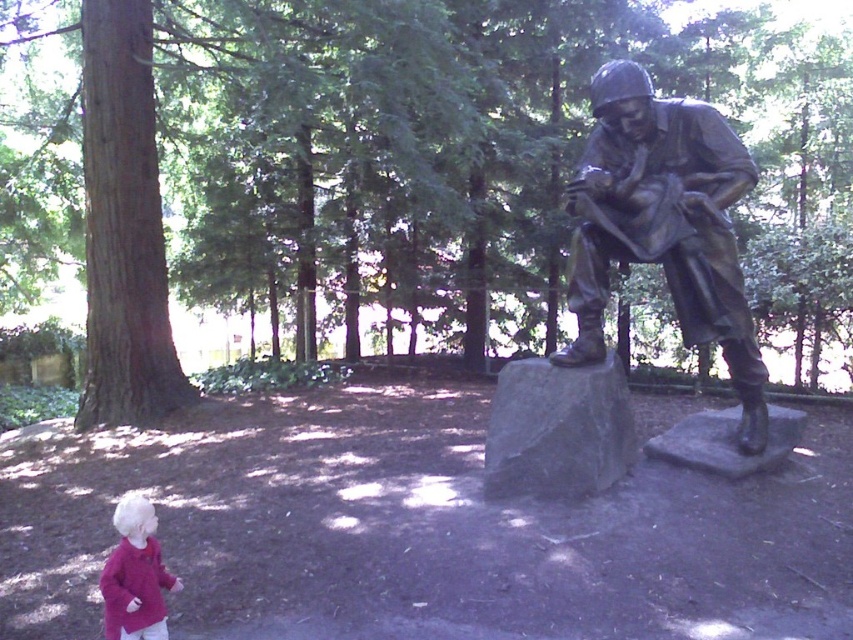
You are a visitor at a park and see the bronze statue at right and the gray stone at center. Which object takes up more space in the image?

The bronze statue at right has a larger size compared to the gray stone at center, so it takes up more space in the image.

You are a photographer trying to capture the bronze statue at right and the matte pink sweater at lower left in the same frame. Based on their positions, which object should you focus on first to ensure both are in the shot?

The bronze statue at right is positioned over the matte pink sweater at lower left, so focusing on the bronze statue at right first will help ensure both are in the frame.